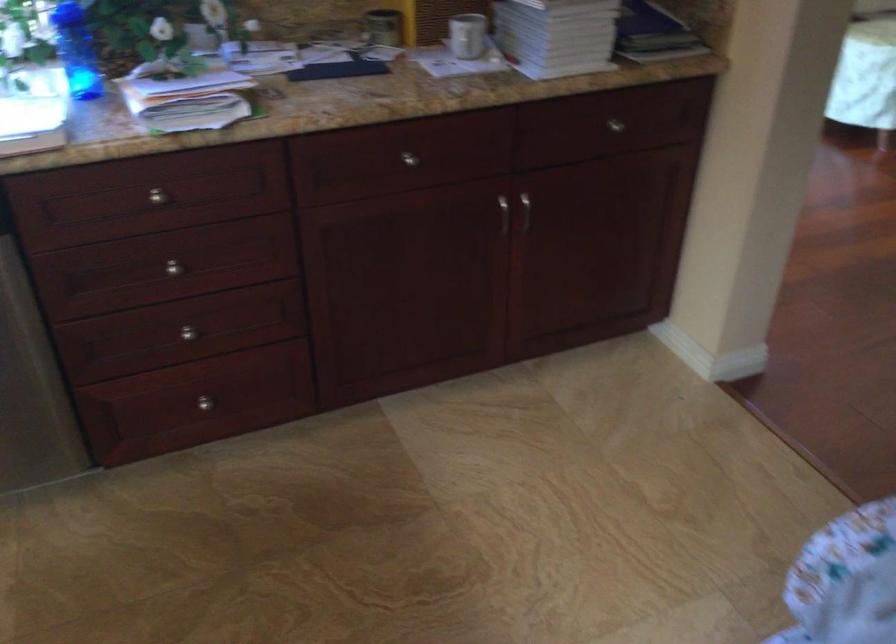
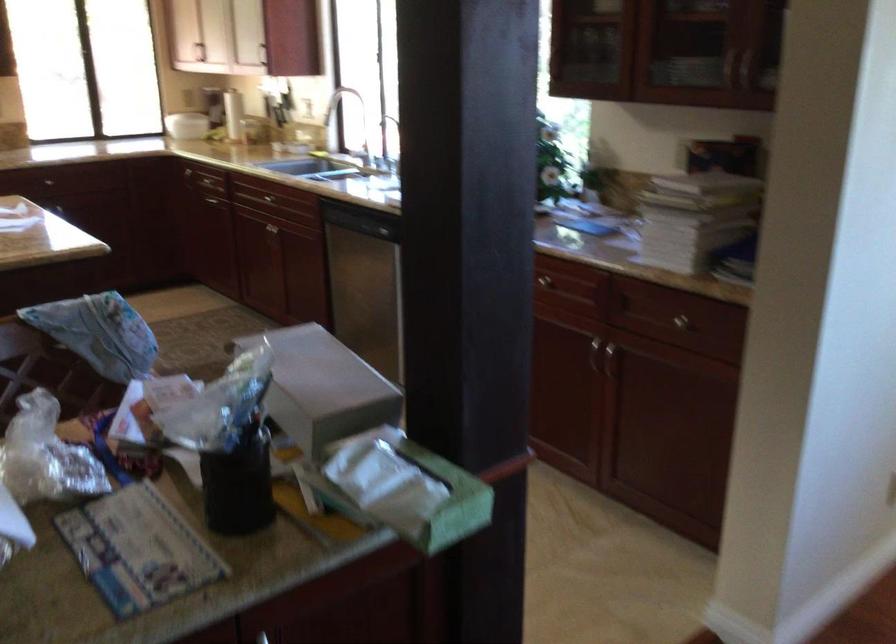
The point at [496,218] is marked in the first image. Where is the corresponding point in the second image?

(593, 355)